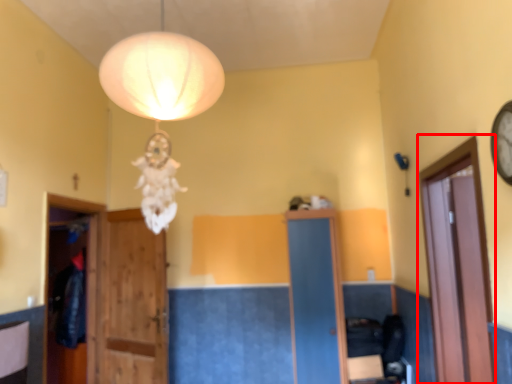
Question: In this image, where is glass door (annotated by the red box) located relative to door?

Choices:
 (A) left
 (B) right

Answer: (B)